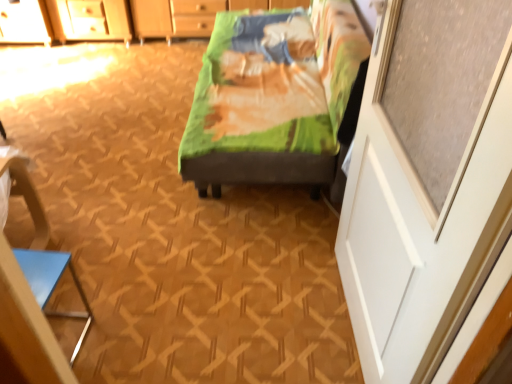
You are a GUI agent. You are given a task and a screenshot of the screen. Output one action in this format:
    pyautogui.click(x=<x>, y=<y>)
    Task: Click on the vacant space underneath white matte screen door at right (from a real-world perspective)
    
    Given the screenshot: What is the action you would take?
    pyautogui.click(x=346, y=322)